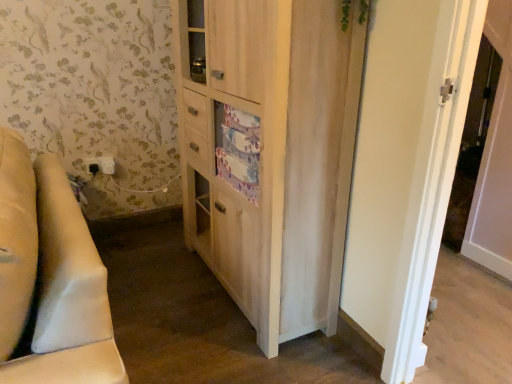
Question: Considering the positions of white plastic screen door at upper right and beige fabric couch at left in the image, is white plastic screen door at upper right wider or thinner than beige fabric couch at left?

Choices:
 (A) wide
 (B) thin

Answer: (A)

Question: Is white plastic screen door at upper right taller or shorter than beige fabric couch at left?

Choices:
 (A) short
 (B) tall

Answer: (B)

Question: Considering the real-world distances, which object is closest to the light wood cabinet at center?

Choices:
 (A) white plastic electric outlet at lower left
 (B) beige fabric couch at left
 (C) green leafy plant at upper center
 (D) white plastic screen door at upper right

Answer: (C)

Question: Based on their relative distances, which object is farther from the green leafy plant at upper center?

Choices:
 (A) white plastic screen door at upper right
 (B) white plastic electric outlet at lower left
 (C) light wood cabinet at center
 (D) beige fabric couch at left

Answer: (A)